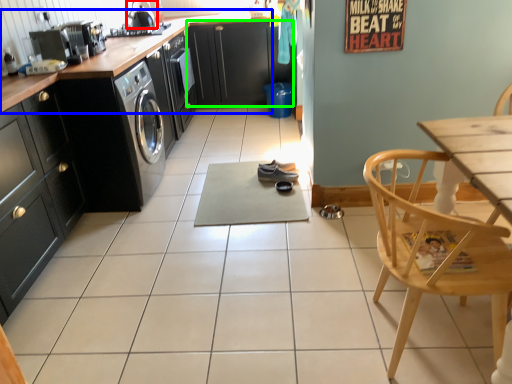
Question: Which is nearer to the appliance (highlighted by a red box)? countertop (highlighted by a blue box) or cabinetry (highlighted by a green box).

Choices:
 (A) countertop
 (B) cabinetry

Answer: (A)